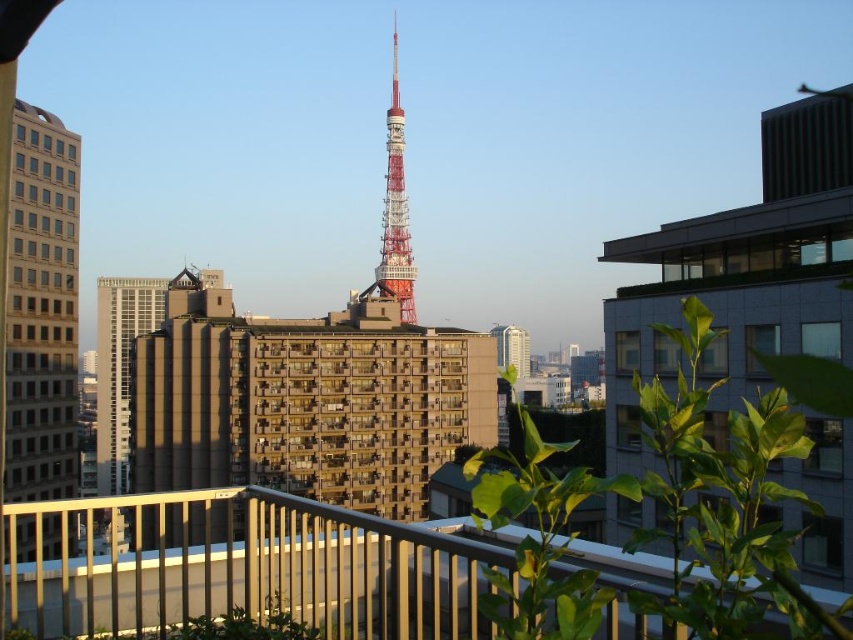
You are standing on a balcony and want to take a photo of the prominent tower with a red and white color scheme in the center. Where should you position yourself relative to the metallic railing at lower center to ensure the tower is fully in frame?

The metallic railing at lower center is located at point (x=247, y=566), so you should position yourself slightly to the right and above the metallic railing at lower center to ensure the tower is fully in frame.

You are a photographer standing on a balcony and want to capture both the metallic railing at lower center and the metallic red tower at center in your shot. Given that your camera can only focus on objects within a 1.5 meter width, will the width difference between them affect your ability to capture both clearly?

The metallic railing at lower center is wider than the metallic red tower at center. Since the camera can focus on objects within a 1.5 meter width, the width difference won not affect your ability to capture both clearly as long as they are within the focus range.

You are standing on a balcony and looking at the scene. You notice two structures in the center of your view. Which one is taller between the matte brown building at center and the metallic red tower at center?

The metallic red tower at center is taller than the matte brown building at center.